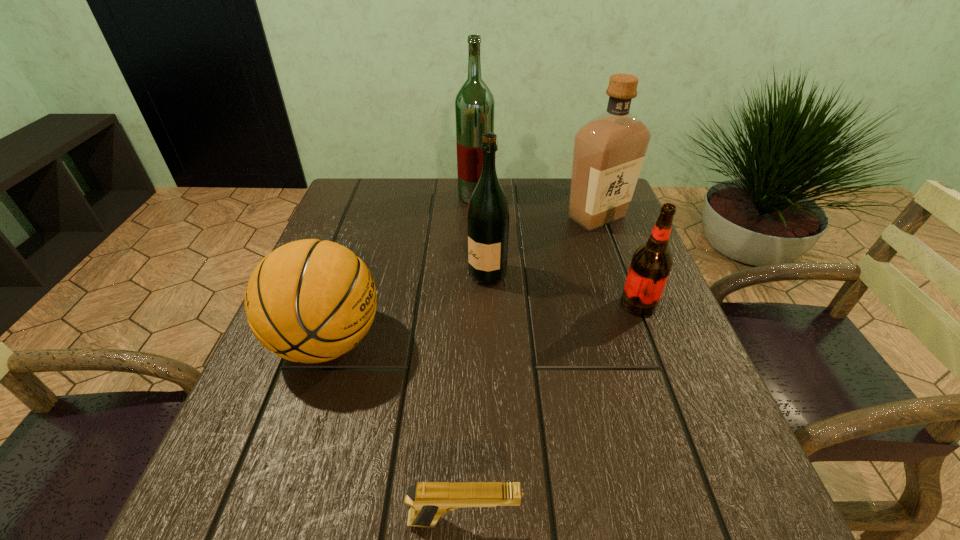
I want to click on vacant region located on the left of the root beer, so click(x=474, y=305).

Find the location of a particular element. vacant space located 0.220m on the surface of the leftmost object near the brand logo is located at coordinates (501, 341).

Image resolution: width=960 pixels, height=540 pixels. Find the location of `blank space located 0.250m at the barrel of the pistol`. blank space located 0.250m at the barrel of the pistol is located at coordinates [x=706, y=521].

Locate an element on the screen. This screenshot has height=540, width=960. object present at the near edge is located at coordinates (428, 500).

At what (x,y) coordinates should I click in order to perform the action: click on object that is at the left edge. Please return your answer as a coordinate pair (x, y). Looking at the image, I should click on (310, 301).

The width and height of the screenshot is (960, 540). Identify the location of liquor at the right edge. (609, 150).

You are a GUI agent. You are given a task and a screenshot of the screen. Output one action in this format:
    pyautogui.click(x=<x>, y=<y>)
    Task: Click on the root beer that is at the right edge
    
    Given the screenshot: What is the action you would take?
    pyautogui.click(x=651, y=263)

Find the location of a particular element. object at the far right corner is located at coordinates point(609,150).

The image size is (960, 540). I want to click on blank space at the far edge of the desktop, so click(x=545, y=212).

This screenshot has height=540, width=960. In the image, there is a desktop. Identify the location of free space at the near edge. (587, 504).